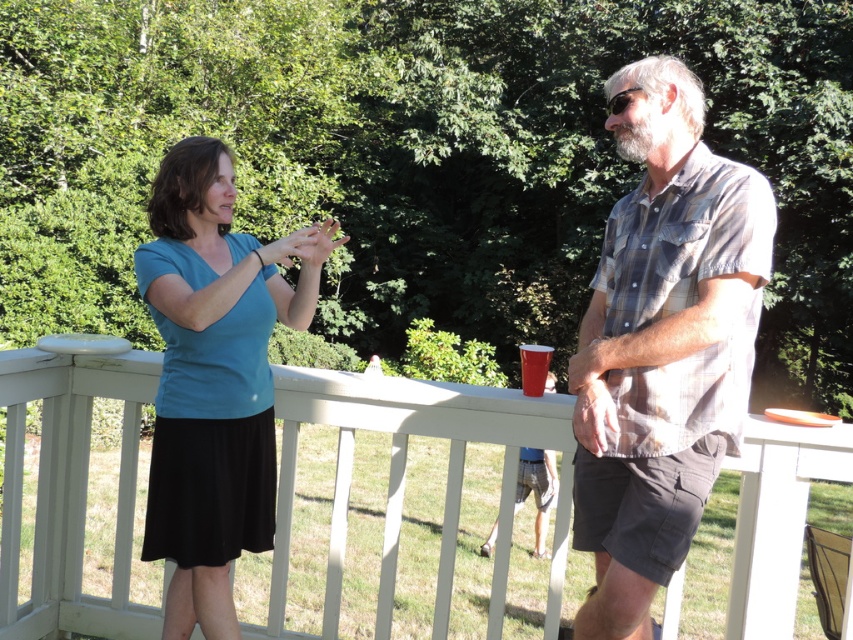
Does matte blue shirt at center appear on the right side of red plastic cup at center?

Incorrect, matte blue shirt at center is not on the right side of red plastic cup at center.

Which is behind, point (212, 216) or point (524, 369)?

Point (524, 369)

You are a GUI agent. You are given a task and a screenshot of the screen. Output one action in this format:
    pyautogui.click(x=<x>, y=<y>)
    Task: Click on the matte blue shirt at center
    The width and height of the screenshot is (853, 640).
    Given the screenshot: What is the action you would take?
    pyautogui.click(x=213, y=378)

Between white wooden railing at upper center and blue cotton shirt at upper center, which one appears on the left side from the viewer's perspective?

Positioned to the left is white wooden railing at upper center.

Which is above, white wooden railing at upper center or blue cotton shirt at upper center?

blue cotton shirt at upper center

Measure the distance between white wooden railing at upper center and camera.

white wooden railing at upper center and camera are 10.33 feet apart from each other.

This screenshot has height=640, width=853. What are the coordinates of `white wooden railing at upper center` in the screenshot? It's located at (404, 480).

Is point (679, 465) less distant than point (140, 556)?

Yes, point (679, 465) is closer to viewer.

Does blue cotton shirt at upper center appear on the left side of matte blue shirt at center?

No, blue cotton shirt at upper center is not to the left of matte blue shirt at center.

Is point (747, 248) closer to camera compared to point (219, 228)?

Yes.

Locate an element on the screen. This screenshot has width=853, height=640. blue cotton shirt at upper center is located at coordinates (662, 344).